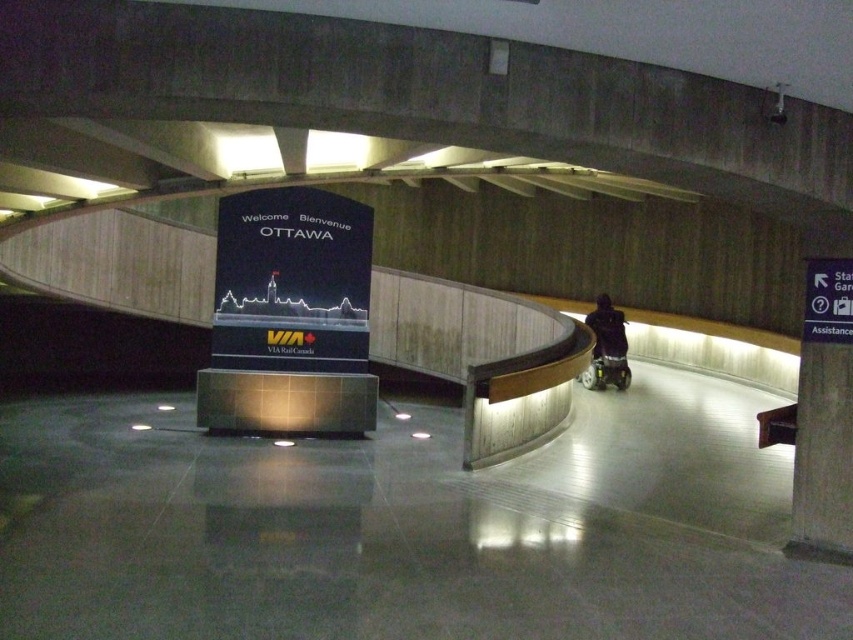
Question: Which of the following is the closest to the observer?

Choices:
 (A) dark blue jacket at center
 (B) metallic silver baby carriage at lower right

Answer: (A)

Question: Observing the image, what is the correct spatial positioning of dark blue jacket at center in reference to metallic silver baby carriage at lower right?

Choices:
 (A) above
 (B) below

Answer: (A)

Question: Which object is closer to the camera taking this photo?

Choices:
 (A) dark blue jacket at center
 (B) metallic silver baby carriage at lower right

Answer: (A)

Question: Is dark blue jacket at center above metallic silver baby carriage at lower right?

Choices:
 (A) no
 (B) yes

Answer: (B)

Question: Is dark blue jacket at center behind metallic silver baby carriage at lower right?

Choices:
 (A) no
 (B) yes

Answer: (A)